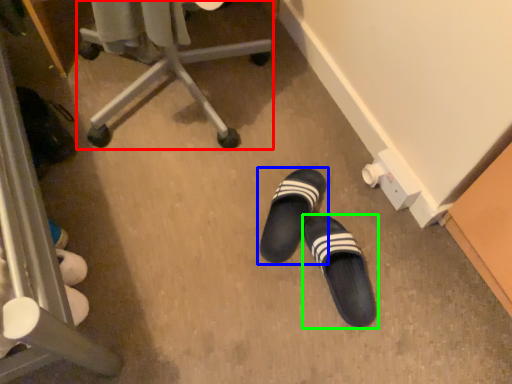
Question: Considering the real-world distances, which object is closest to furniture (highlighted by a red box)? footwear (highlighted by a blue box) or footwear (highlighted by a green box).

Choices:
 (A) footwear
 (B) footwear

Answer: (A)